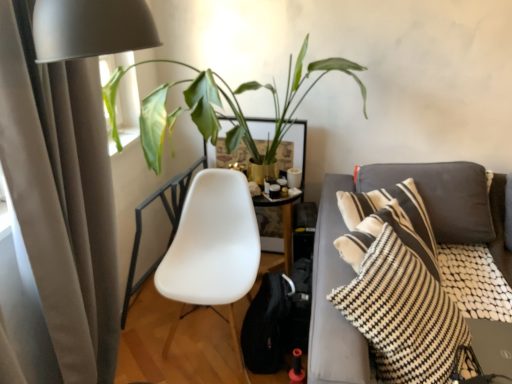
Question: Is black and white striped pillow at right inside the boundaries of green leafy plant at upper left, or outside?

Choices:
 (A) outside
 (B) inside

Answer: (A)

Question: Relative to green leafy plant at upper left, is black and white striped pillow at right in front or behind?

Choices:
 (A) behind
 (B) front

Answer: (B)

Question: Considering the real-world distances, which object is closest to the white plastic chair at center?

Choices:
 (A) black and white striped pillow at right
 (B) beige fabric curtain at left
 (C) green leafy plant at upper left

Answer: (C)

Question: Estimate the real-world distances between objects in this image. Which object is farther from the white plastic chair at center?

Choices:
 (A) beige fabric curtain at left
 (B) black and white striped pillow at right
 (C) green leafy plant at upper left

Answer: (B)